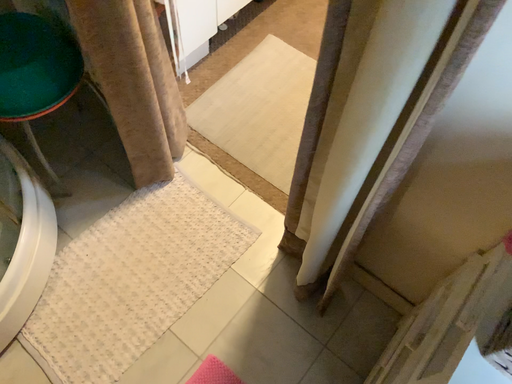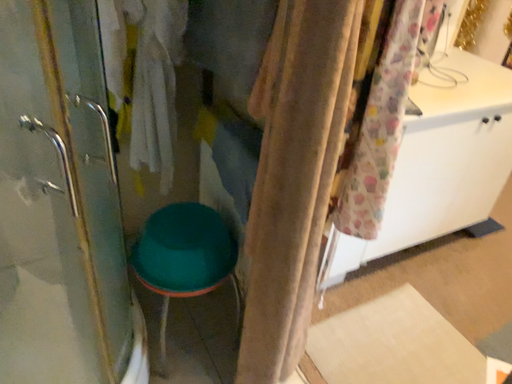
Question: Which way did the camera rotate in the video?

Choices:
 (A) rotated upward
 (B) rotated downward

Answer: (A)